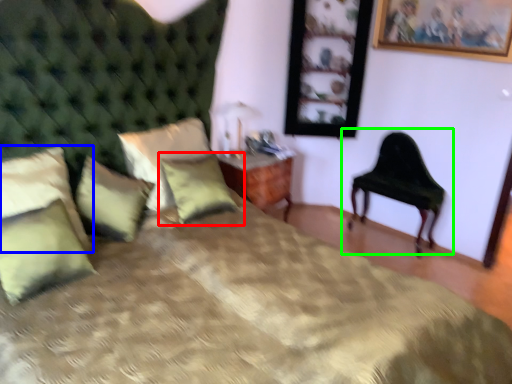
Question: Based on their relative distances, which object is nearer to pillow (highlighted by a red box)? Choose from pillow (highlighted by a blue box) and chair (highlighted by a green box).

Choices:
 (A) pillow
 (B) chair

Answer: (A)